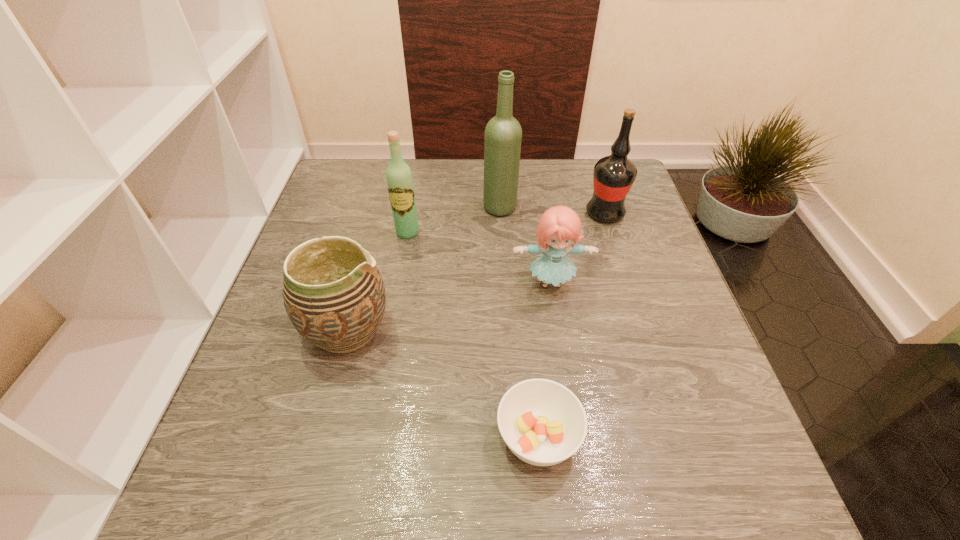
In order to click on vacant space located on the front-facing side of the leftmost wine bottle in this screenshot , I will do `click(384, 364)`.

What are the coordinates of `vacant space located 0.350m on the front-facing side of the doll` in the screenshot? It's located at (577, 457).

Identify the location of vacant space located on the front of the pottery. (314, 461).

At what (x,y) coordinates should I click in order to perform the action: click on vacant space located 0.280m on the left of the shortest object. Please return your answer as a coordinate pair (x, y). This screenshot has width=960, height=540. Looking at the image, I should click on (335, 437).

Where is `object present at the near edge`? The height and width of the screenshot is (540, 960). object present at the near edge is located at coordinates (542, 422).

What are the coordinates of `object positioned at the left edge` in the screenshot? It's located at (333, 293).

I want to click on object that is at the right edge, so click(x=613, y=176).

Image resolution: width=960 pixels, height=540 pixels. What are the coordinates of `object located at the far right corner` in the screenshot? It's located at (613, 176).

Locate an element on the screen. vacant position at the far edge of the desktop is located at coordinates (483, 187).

What are the coordinates of `free location at the near edge` in the screenshot? It's located at (649, 500).